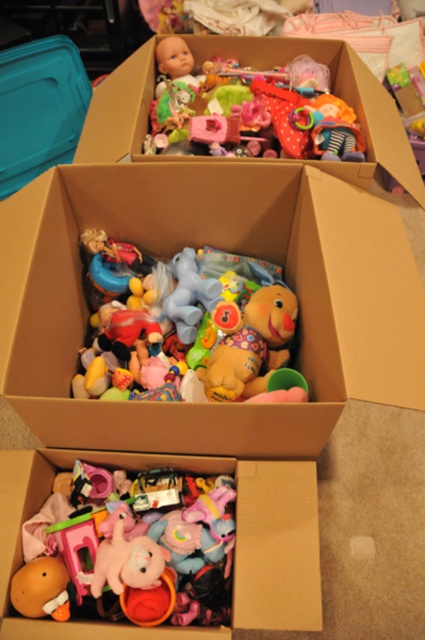
What is located at the coordinates point (130, 544)?

The point (130, 544) indicates a soft plush toy at lower center.

Looking at the boxes of toys, where is the soft plush toy at lower center in relation to the matte plastic doll at upper center?

The soft plush toy at lower center is to the left of the matte plastic doll at upper center.

Looking at the boxes of toys, which object is taller between the soft plush toys at center and the soft plush duck at center?

The soft plush toys at center is much taller than the soft plush duck at center.